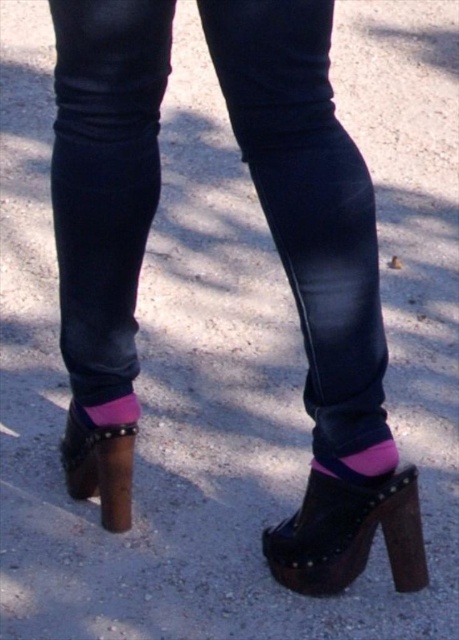
Question: From the image, what is the correct spatial relationship of black leather platform shoe at lower center in relation to leather platform sandal at lower left?

Choices:
 (A) left
 (B) right

Answer: (B)

Question: Is black leather platform shoe at lower center smaller than pink fabric sock at lower center?

Choices:
 (A) no
 (B) yes

Answer: (A)

Question: Among these objects, which one is nearest to the camera?

Choices:
 (A) pink fabric sock at lower center
 (B) pink suede sock at lower center
 (C) black leather platform shoe at lower center

Answer: (C)

Question: Does leather platform sandal at lower left appear on the left side of pink suede sock at lower center?

Choices:
 (A) no
 (B) yes

Answer: (B)

Question: Which of the following is the closest to the observer?

Choices:
 (A) (130, 422)
 (B) (311, 467)

Answer: (B)

Question: Which object appears farthest from the camera in this image?

Choices:
 (A) dark blue denim jeans at center
 (B) pink fabric sock at lower center
 (C) black leather platform shoe at lower center
 (D) leather platform sandal at lower left

Answer: (B)